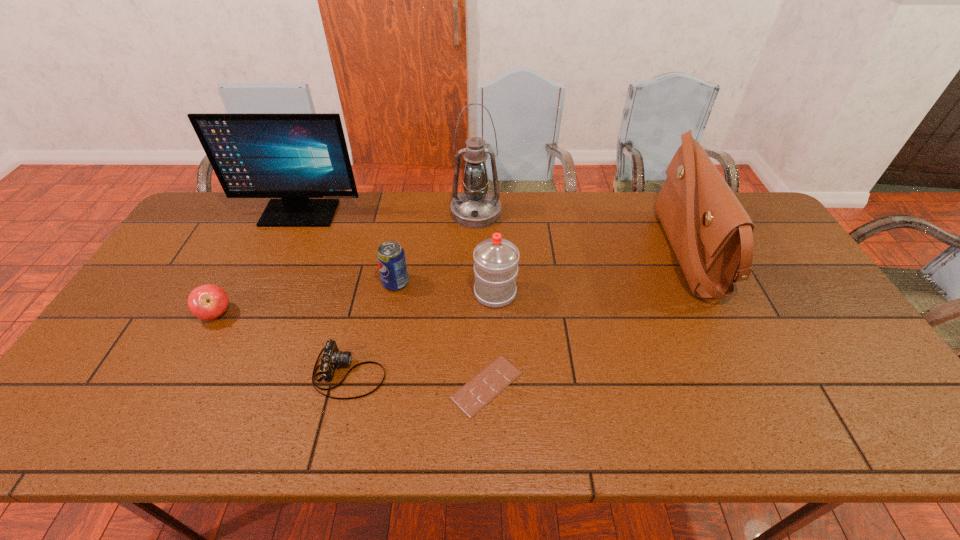
Identify the location of blank area located 0.220m on the screen side of the monitor. This screenshot has height=540, width=960. (272, 274).

The height and width of the screenshot is (540, 960). I want to click on blank area located on the front flap of the third tallest object, so click(x=608, y=253).

At what (x,y) coordinates should I click in order to perform the action: click on vacant space located on the front flap of the third tallest object. Please return your answer as a coordinate pair (x, y). Looking at the image, I should click on (531, 253).

I want to click on blank space located on the front flap of the third tallest object, so click(x=572, y=253).

Find the location of a particular element. The height and width of the screenshot is (540, 960). free location located 0.280m on the handle side of the fourth tallest object is located at coordinates (492, 218).

At what (x,y) coordinates should I click in order to perform the action: click on free space located 0.290m on the handle side of the fourth tallest object. Please return your answer as a coordinate pair (x, y). The image size is (960, 540). Looking at the image, I should click on (492, 216).

The image size is (960, 540). Find the location of `blank space located 0.270m on the handle side of the fourth tallest object`. blank space located 0.270m on the handle side of the fourth tallest object is located at coordinates (492, 220).

At what (x,y) coordinates should I click in order to perform the action: click on free space located 0.160m on the front of the soda. Please return your answer as a coordinate pair (x, y). Looking at the image, I should click on (386, 338).

Find the location of `vacant space located on the back of the sixth tallest object`. vacant space located on the back of the sixth tallest object is located at coordinates (251, 249).

Find the location of a particular element. The image size is (960, 540). free spot located on the front-facing side of the camera is located at coordinates (550, 373).